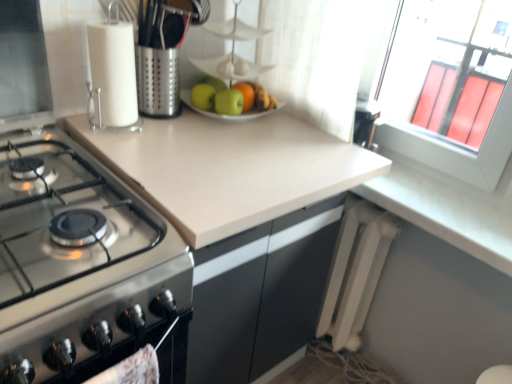
Locate an element on the screen. This screenshot has height=384, width=512. vacant space to the right of green matte apple at center, the first apple when ordered from left to right is located at coordinates (272, 124).